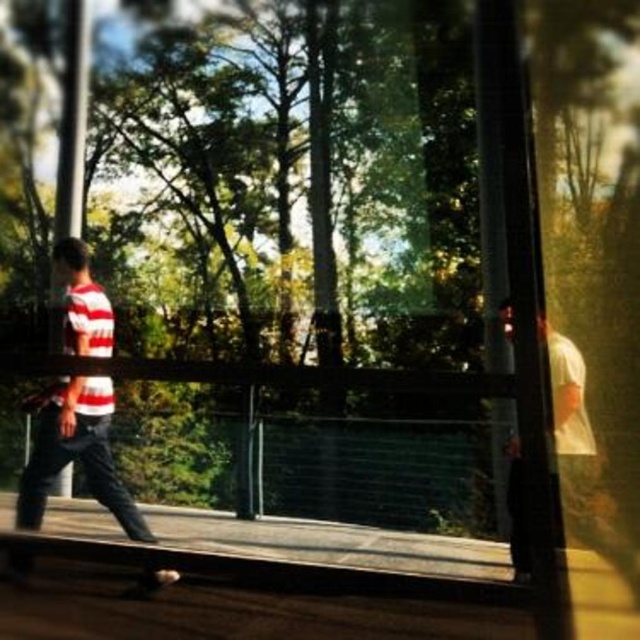
Does striped cotton shirt at left have a lesser width compared to smooth black skateboard at lower center?

No.

Can you confirm if striped cotton shirt at left is smaller than smooth black skateboard at lower center?

No.

Who is more forward, (81, 333) or (24, 538)?

Positioned in front is point (24, 538).

At what (x,y) coordinates should I click in order to perform the action: click on striped cotton shirt at left. Please return your answer as a coordinate pair (x, y). The image size is (640, 640). Looking at the image, I should click on (76, 451).